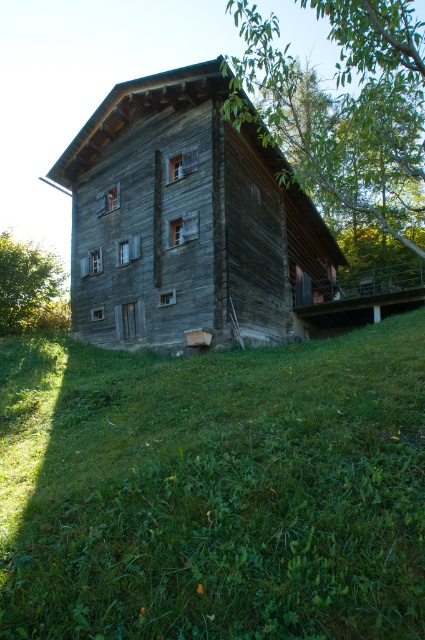
The width and height of the screenshot is (425, 640). Describe the element at coordinates (214, 490) in the screenshot. I see `green grassy at lower center` at that location.

Which of these two, green grassy at lower center or green leafy tree at upper right, stands shorter?

green grassy at lower center is shorter.

Between point (274, 374) and point (382, 44), which one is positioned behind?

Point (274, 374)

You are a GUI agent. You are given a task and a screenshot of the screen. Output one action in this format:
    pyautogui.click(x=<x>, y=<y>)
    Task: Click on the green grassy at lower center
    
    Given the screenshot: What is the action you would take?
    pyautogui.click(x=214, y=490)

Can you confirm if green leafy tree at upper right is thinner than green leafy tree at lower left?

No, green leafy tree at upper right is not thinner than green leafy tree at lower left.

Can you confirm if green leafy tree at upper right is positioned above green leafy tree at lower left?

Yes, green leafy tree at upper right is above green leafy tree at lower left.

Between point (396, 184) and point (45, 275), which one is positioned behind?

The point (396, 184) is more distant.

You are a GUI agent. You are given a task and a screenshot of the screen. Output one action in this format:
    pyautogui.click(x=<x>, y=<y>)
    Task: Click on the green leafy tree at upper right
    The width and height of the screenshot is (425, 640).
    Given the screenshot: What is the action you would take?
    pyautogui.click(x=343, y=113)

The height and width of the screenshot is (640, 425). What do you see at coordinates (214, 490) in the screenshot?
I see `green grassy at lower center` at bounding box center [214, 490].

Who is more distant from viewer, (399, 481) or (57, 288)?

Positioned behind is point (57, 288).

The height and width of the screenshot is (640, 425). I want to click on green grassy at lower center, so click(214, 490).